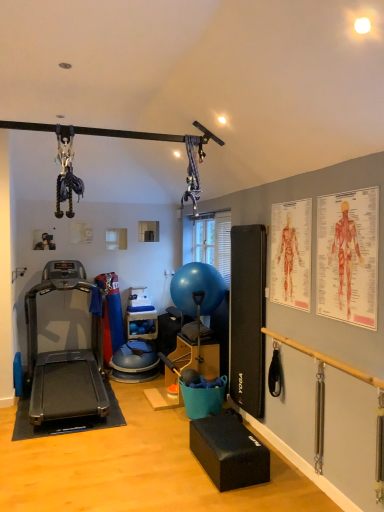
In order to click on blue rubber ball at center in this screenshot , I will do `click(197, 288)`.

Measure the distance between wooden bar at right and camera.

7.67 feet.

This screenshot has height=512, width=384. Identify the location of metallic silver photo frame at upper left, which is the first person from left to right. (43, 241).

In the scene shown: Is wooden bar at right placed right next to metallic silver photo frame at upper left, acting as the second person starting from the right?

No, wooden bar at right is not in contact with metallic silver photo frame at upper left, acting as the second person starting from the right.

In terms of width, does wooden bar at right look wider or thinner when compared to metallic silver photo frame at upper left, which is the first person from left to right?

wooden bar at right is wider than metallic silver photo frame at upper left, which is the first person from left to right.

Looking at this image, from a real-world perspective, is wooden bar at right on top of metallic silver photo frame at upper left, the first person in the back-to-front sequence?

No, from a real-world perspective, wooden bar at right is not on top of metallic silver photo frame at upper left, the first person in the back-to-front sequence.

Is wooden bar at right oriented away from metallic silver photo frame at upper left, acting as the second person starting from the right?

No, wooden bar at right's orientation is not away from metallic silver photo frame at upper left, acting as the second person starting from the right.

Could you measure the distance between metallic silver photo frame at upper left, which appears as the 2th person when viewed from the front, and anatomical chart at upper right, arranged as the first person when viewed from the front?

metallic silver photo frame at upper left, which appears as the 2th person when viewed from the front, and anatomical chart at upper right, arranged as the first person when viewed from the front, are 3.35 meters apart.

From a real-world perspective, who is located higher, metallic silver photo frame at upper left, which appears as the 2th person when viewed from the front, or anatomical chart at upper right, which is the first person from right to left?

metallic silver photo frame at upper left, which appears as the 2th person when viewed from the front, from a real-world perspective.

Is metallic silver photo frame at upper left, the first person in the back-to-front sequence, inside the boundaries of anatomical chart at upper right, the second person positioned from the back, or outside?

metallic silver photo frame at upper left, the first person in the back-to-front sequence, is not enclosed by anatomical chart at upper right, the second person positioned from the back.

Can you confirm if metallic silver photo frame at upper left, acting as the second person starting from the right, is smaller than anatomical chart at upper right, which is the first person from right to left?

Yes, metallic silver photo frame at upper left, acting as the second person starting from the right, is smaller than anatomical chart at upper right, which is the first person from right to left.

In the image, is wooden bar at right on the left side or the right side of anatomical chart at upper right, the second person positioned from the back?

wooden bar at right is to the right of anatomical chart at upper right, the second person positioned from the back.

Is wooden bar at right far from anatomical chart at upper right, which is the first person from right to left?

wooden bar at right is near anatomical chart at upper right, which is the first person from right to left, not far away.

Is wooden bar at right in front of or behind anatomical chart at upper right, the second person positioned from the back, in the image?

In the image, wooden bar at right appears in front of anatomical chart at upper right, the second person positioned from the back.

Which is closer, (338, 362) or (287, 216)?

The point (338, 362) is more forward.

Does black rubber treadmill at left have a greater width compared to metallic silver photo frame at upper left, which appears as the 2th person when viewed from the front?

Yes.

Is black rubber treadmill at left bigger than metallic silver photo frame at upper left, the first person in the back-to-front sequence?

Indeed, black rubber treadmill at left has a larger size compared to metallic silver photo frame at upper left, the first person in the back-to-front sequence.

Is there a large distance between black rubber treadmill at left and metallic silver photo frame at upper left, which is the first person from left to right?

black rubber treadmill at left is far away from metallic silver photo frame at upper left, which is the first person from left to right.

Consider the image. Is black rubber treadmill at left facing towards metallic silver photo frame at upper left, which appears as the 2th person when viewed from the front?

No.

Which of these two, blue rubber ball at center or blue rubber shelf at center, is smaller?

blue rubber shelf at center is smaller.

Considering the relative positions of blue rubber ball at center and blue rubber shelf at center in the image provided, is blue rubber ball at center to the left of blue rubber shelf at center from the viewer's perspective?

No.

Is the depth of blue rubber ball at center less than that of blue rubber shelf at center?

That is True.

From the image's perspective, between blue rubber ball at center and blue rubber shelf at center, who is located below?

From the image's view, blue rubber shelf at center is below.

The height and width of the screenshot is (512, 384). Find the location of `rail in front of the blue rubber ball at center`. rail in front of the blue rubber ball at center is located at coordinates (326, 359).

From the image's perspective, is wooden bar at right over blue rubber ball at center?

No, from the image's perspective, wooden bar at right is not over blue rubber ball at center.

From a real-world perspective, is wooden bar at right beneath blue rubber ball at center?

Yes, from a real-world perspective, wooden bar at right is beneath blue rubber ball at center.

Which is further, (x=382, y=384) or (x=196, y=290)?

The point (x=196, y=290) is more distant.

Is wooden bar at right positioned in front of red paper human anatomy chart at upper right?

Yes, the depth of wooden bar at right is less than that of red paper human anatomy chart at upper right.

Is wooden bar at right bigger than red paper human anatomy chart at upper right?

Yes.

Looking at this image, is wooden bar at right in contact with red paper human anatomy chart at upper right?

wooden bar at right and red paper human anatomy chart at upper right are not in contact.

Can you tell me how much wooden bar at right and red paper human anatomy chart at upper right differ in facing direction?

0.311 degrees.

Where is `rail on the right of metallic silver photo frame at upper left, acting as the second person starting from the right`? rail on the right of metallic silver photo frame at upper left, acting as the second person starting from the right is located at coordinates (326, 359).

This screenshot has height=512, width=384. Identify the location of person that is behind the anatomical chart at upper right, which is the first person from right to left. (43, 241).

Which object lies further to the anchor point black rubber treadmill at left, blue rubber ball at center or metallic silver photo frame at upper left, which appears as the 2th person when viewed from the front?

metallic silver photo frame at upper left, which appears as the 2th person when viewed from the front, lies further to black rubber treadmill at left than the other object.

When comparing their distances from wooden bar at right, does blue rubber ball at center or black rubber treadmill at left seem closer?

Among the two, blue rubber ball at center is located nearer to wooden bar at right.

Based on their spatial positions, is blue rubber shelf at center or wooden bar at right further from blue rubber ball at center?

wooden bar at right is positioned further to the anchor blue rubber ball at center.

Based on their spatial positions, is wooden bar at right or black rubber treadmill at left closer to blue rubber shelf at center?

black rubber treadmill at left lies closer to blue rubber shelf at center than the other object.

From the image, which object appears to be farther from wooden bar at right, blue rubber ball at center or blue rubber shelf at center?

blue rubber shelf at center is further to wooden bar at right.

Looking at this image, which object lies nearer to the anchor point anatomical chart at upper right, which is the first person from right to left, black rubber treadmill at left or red paper human anatomy chart at upper right?

Based on the image, red paper human anatomy chart at upper right appears to be nearer to anatomical chart at upper right, which is the first person from right to left.

Looking at the image, which one is located further to black rubber treadmill at left, wooden bar at right or anatomical chart at upper right, the second person positioned from the left?

anatomical chart at upper right, the second person positioned from the left.

Considering their positions, is blue rubber shelf at center positioned closer to metallic silver photo frame at upper left, which appears as the 2th person when viewed from the front, than wooden bar at right?

blue rubber shelf at center is positioned closer to the anchor metallic silver photo frame at upper left, which appears as the 2th person when viewed from the front.

At what (x,y) coordinates should I click in order to perform the action: click on person between wooden bar at right and blue rubber ball at center along the z-axis. Please return your answer as a coordinate pair (x, y). The image size is (384, 512). Looking at the image, I should click on (289, 256).

Identify the location of treadmill between metallic silver photo frame at upper left, which appears as the 2th person when viewed from the front, and blue rubber ball at center. The height and width of the screenshot is (512, 384). (64, 356).

Where is `balloon between anatomical chart at upper right, the second person positioned from the left, and blue rubber shelf at center, along the z-axis`? This screenshot has width=384, height=512. balloon between anatomical chart at upper right, the second person positioned from the left, and blue rubber shelf at center, along the z-axis is located at coordinates (197, 288).

Where is `treadmill between wooden bar at right and blue rubber shelf at center from front to back`? The image size is (384, 512). treadmill between wooden bar at right and blue rubber shelf at center from front to back is located at coordinates (64, 356).